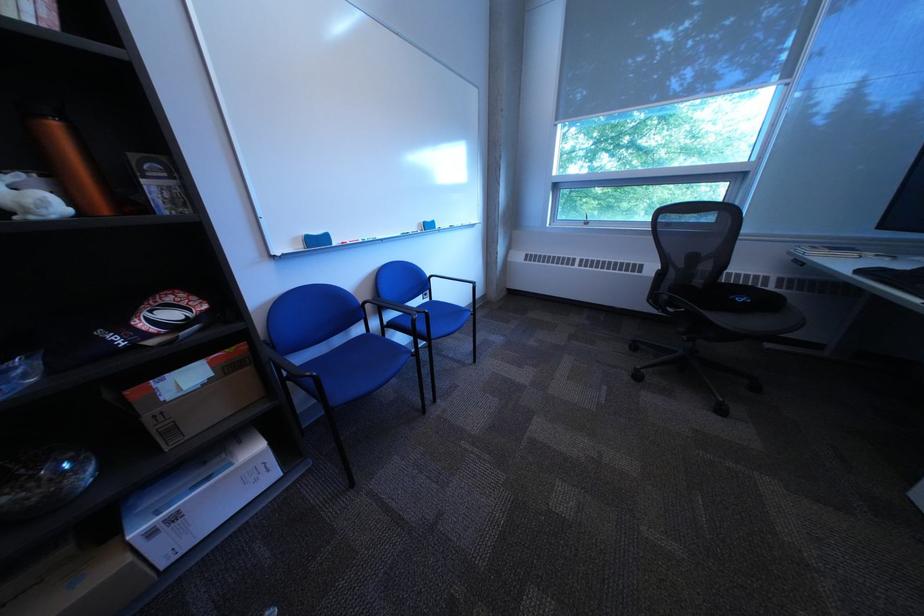
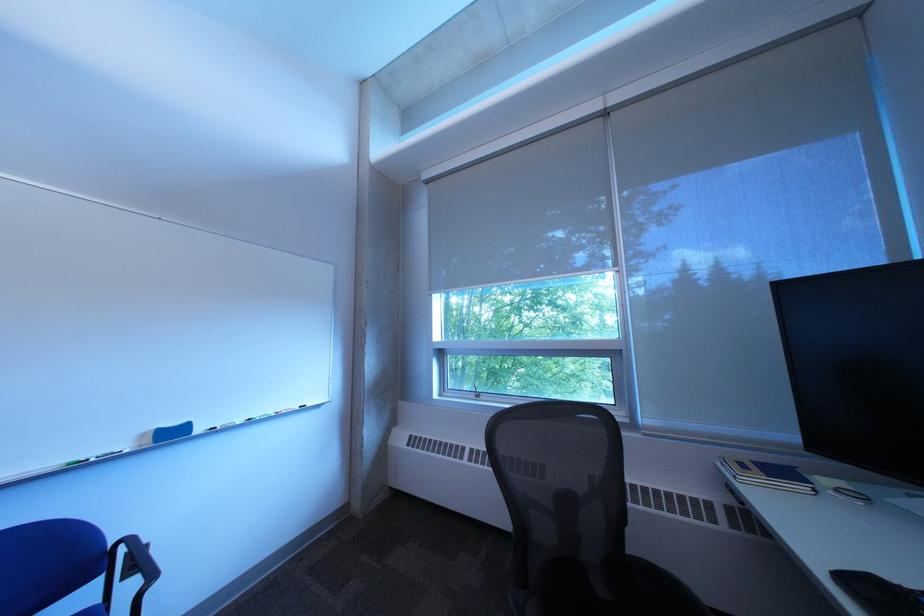
Where in the second image is the point corresponding to pixel 434 225 from the first image?

(159, 437)